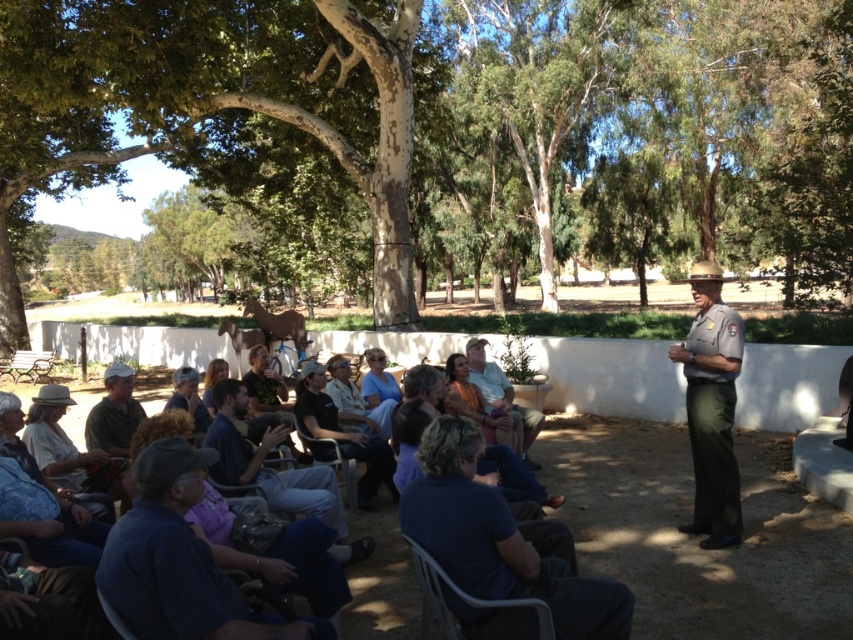
Question: Does dark blue shirt at lower left appear over metallic gray chair at center?

Choices:
 (A) yes
 (B) no

Answer: (A)

Question: Is gray uniform at right thinner than dark gray uniform at center?

Choices:
 (A) no
 (B) yes

Answer: (B)

Question: Which object appears farthest from the camera in this image?

Choices:
 (A) dark blue shirt at center
 (B) light brown leather jacket at center
 (C) smooth bark tree at center
 (D) gray uniform at right

Answer: (C)

Question: Which point appears closest to the camera in this image?

Choices:
 (A) (495, 364)
 (B) (483, 467)
 (C) (384, 490)

Answer: (B)

Question: Which object is positioned farthest from the gray uniform at right?

Choices:
 (A) dark blue shirt at lower left
 (B) metallic gray chair at lower center
 (C) blue denim shirt at center

Answer: (A)

Question: Does blue denim shirt at center have a smaller size compared to green fabric shirt at lower left?

Choices:
 (A) no
 (B) yes

Answer: (A)